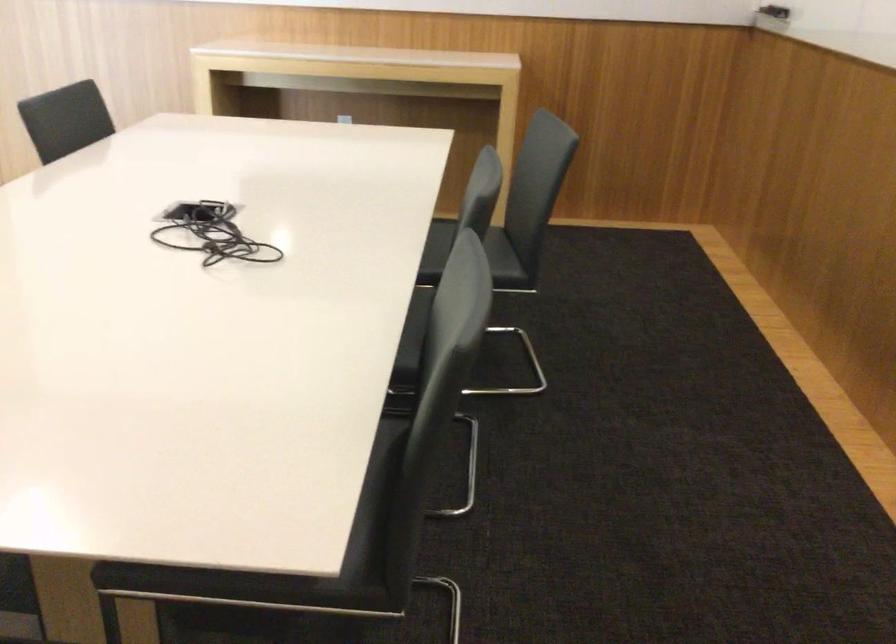
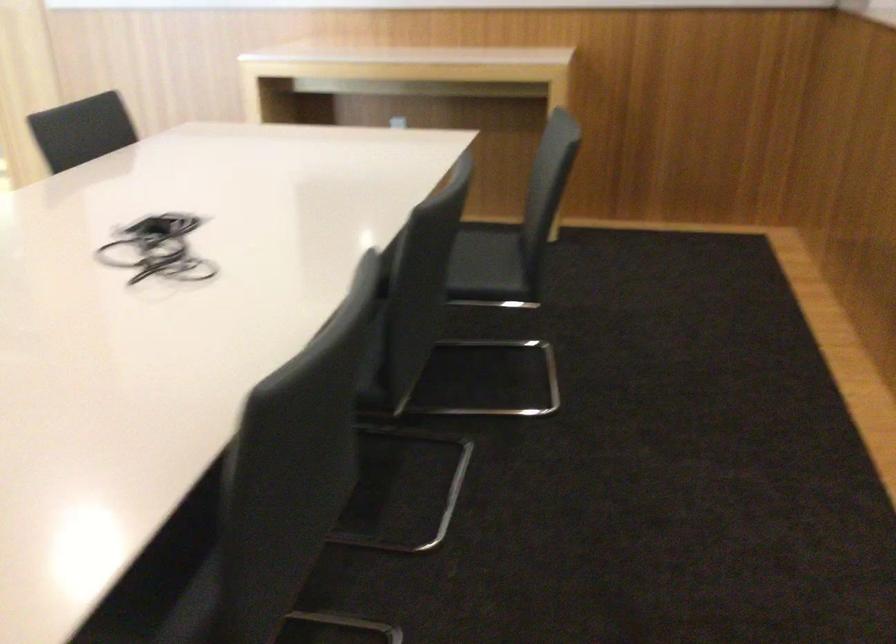
In the second image, find the point that corresponds to (x=184, y=237) in the first image.

(158, 249)